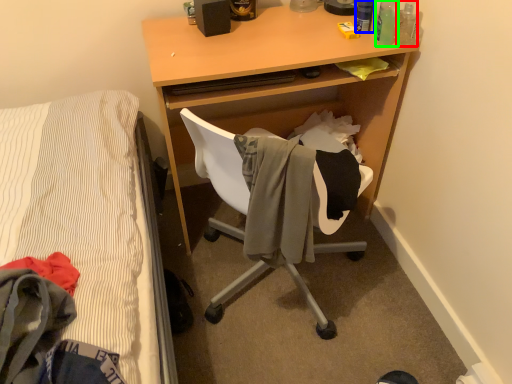
Question: Estimate the real-world distances between objects in this image. Which object is closer to bottle (highlighted by a red box), bottle (highlighted by a blue box) or bottle (highlighted by a green box)?

Choices:
 (A) bottle
 (B) bottle

Answer: (B)